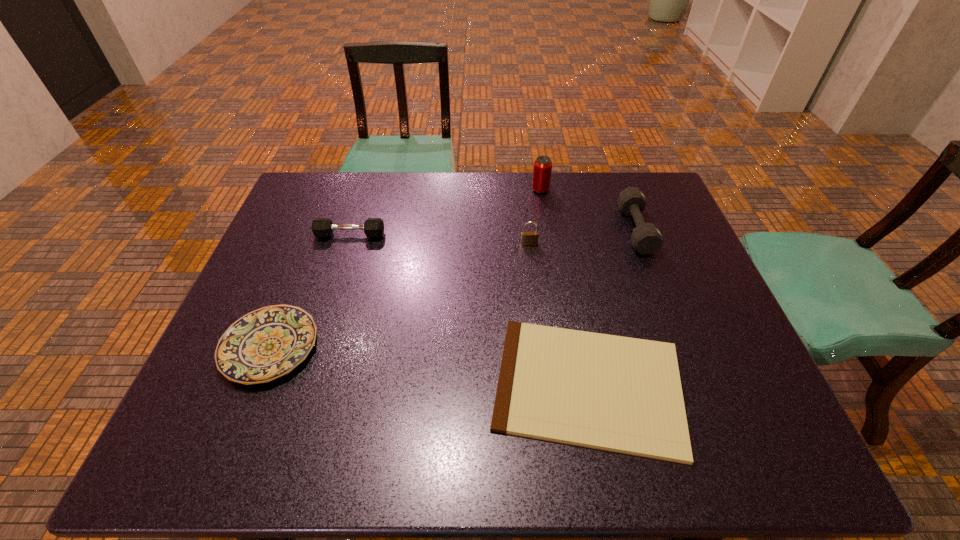
The height and width of the screenshot is (540, 960). I want to click on vacant space located 0.340m on the front of the taller dumbbell, so click(x=684, y=357).

Identify the location of vacant space located 0.050m on the back of the fourth tallest object. (355, 219).

Locate an element on the screen. The height and width of the screenshot is (540, 960). vacant space located on the back of the plate is located at coordinates (x=311, y=244).

Locate an element on the screen. blank area located on the right of the clipboard is located at coordinates (720, 386).

Where is `can that is at the far edge`? can that is at the far edge is located at coordinates (542, 170).

Find the location of a particular element. The width and height of the screenshot is (960, 540). dumbbell situated at the far edge is located at coordinates (646, 238).

The height and width of the screenshot is (540, 960). I want to click on object present at the near edge, so click(x=620, y=394).

Locate an element on the screen. This screenshot has height=540, width=960. dumbbell located in the left edge section of the desktop is located at coordinates (321, 227).

Identify the location of plate present at the left edge. Image resolution: width=960 pixels, height=540 pixels. (265, 344).

You are a GUI agent. You are given a task and a screenshot of the screen. Output one action in this format:
    pyautogui.click(x=<x>, y=<y>)
    Task: Click on the dumbbell situated at the right edge
    The width and height of the screenshot is (960, 540).
    Given the screenshot: What is the action you would take?
    pyautogui.click(x=646, y=238)